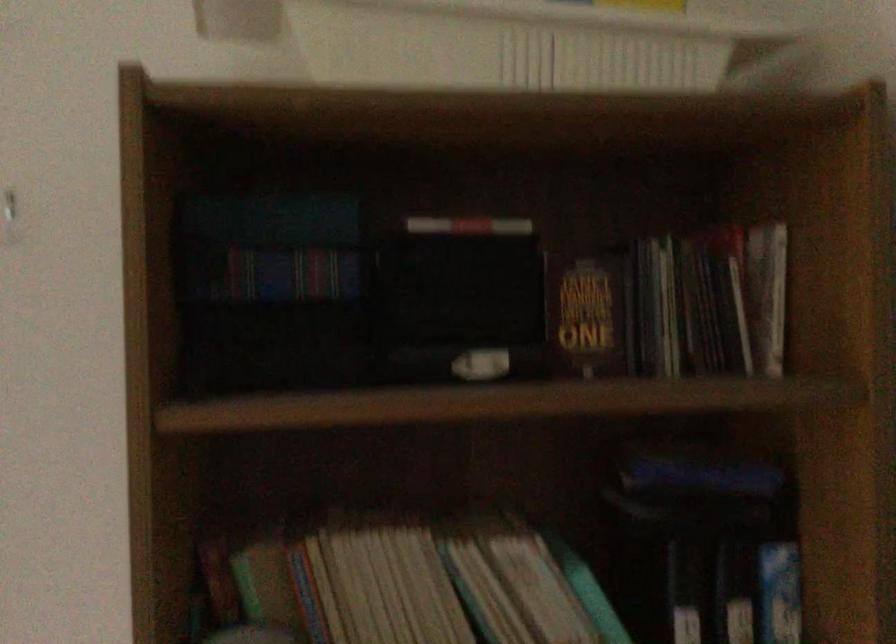
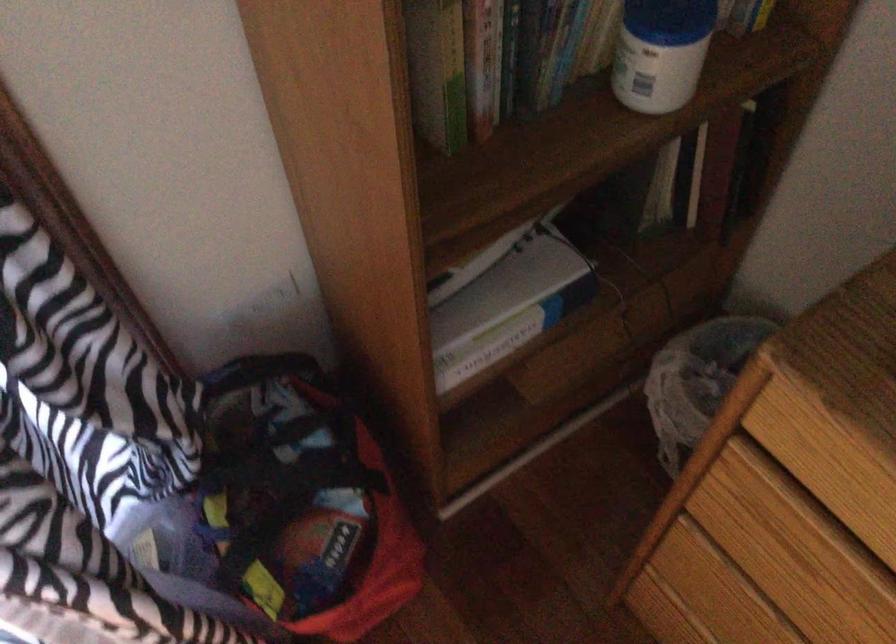
The images are taken continuously from a first-person perspective. In which direction is your viewpoint rotating?

The rotation direction of the camera is right-down.